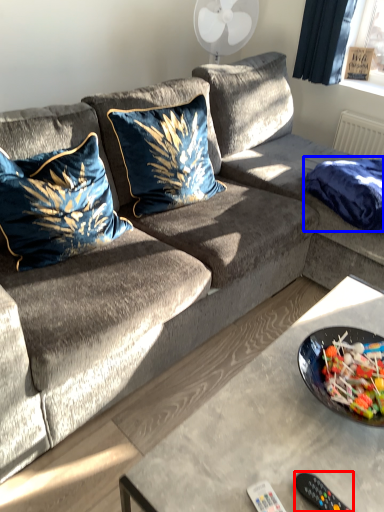
Question: Among these objects, which one is nearest to the camera, remote control (highlighted by a red box) or blanket (highlighted by a blue box)?

Choices:
 (A) remote control
 (B) blanket

Answer: (A)